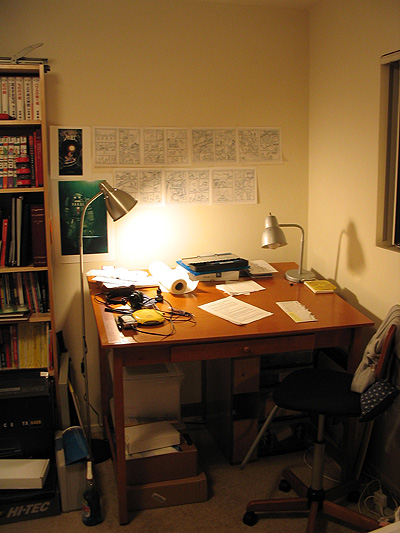
Identify the location of wall. (160, 91), (363, 196).